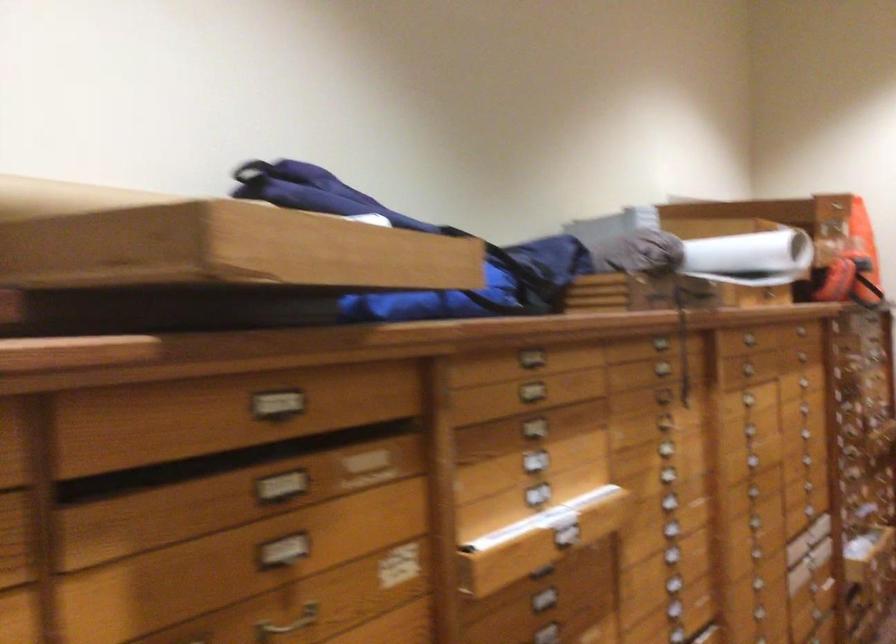
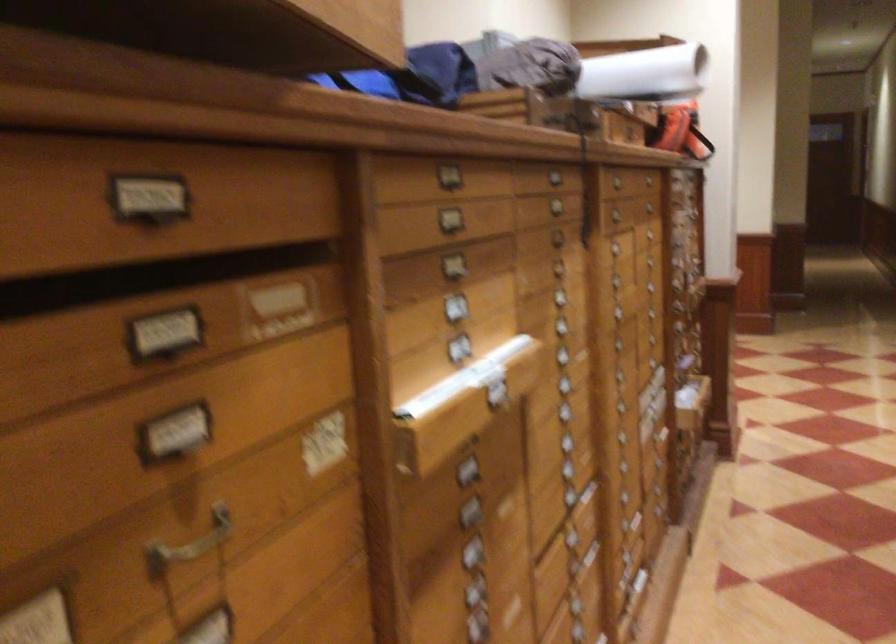
Question: The images are taken continuously from a first-person perspective. In which direction is your viewpoint rotating?

Choices:
 (A) Left
 (B) Right
 (C) Up
 (D) Down

Answer: (B)